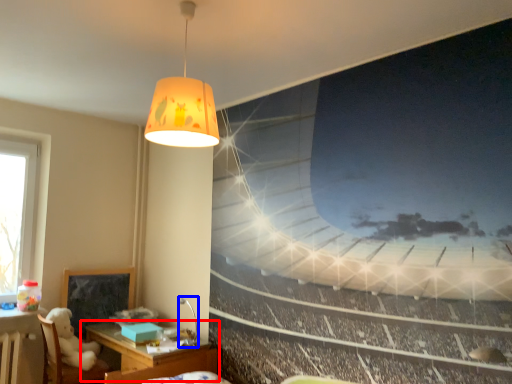
Question: Which of the following is the farthest to the observer, table (highlighted by a red box) or lamp (highlighted by a blue box)?

Choices:
 (A) table
 (B) lamp

Answer: (B)